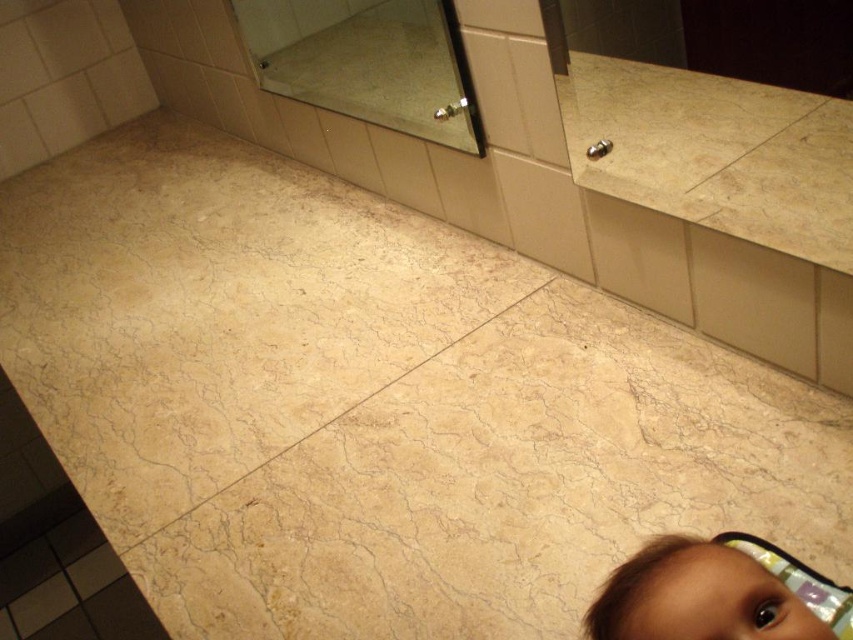
You are standing in the bathroom and see the clear glass mirror at upper center and the brown hair at lower right. Which object is positioned higher up?

The clear glass mirror at upper center is positioned higher up than the brown hair at lower right.

You are designing a layout for a bathroom and need to ensure that the clear glass mirror at upper center and the brown hair at lower right are visible in the mirror. Given their sizes, which object will be fully visible in the mirror?

The clear glass mirror at upper center is bigger than the brown hair at lower right, so the brown hair at lower right will be fully visible in the mirror since it is smaller and the mirror can accommodate its size.